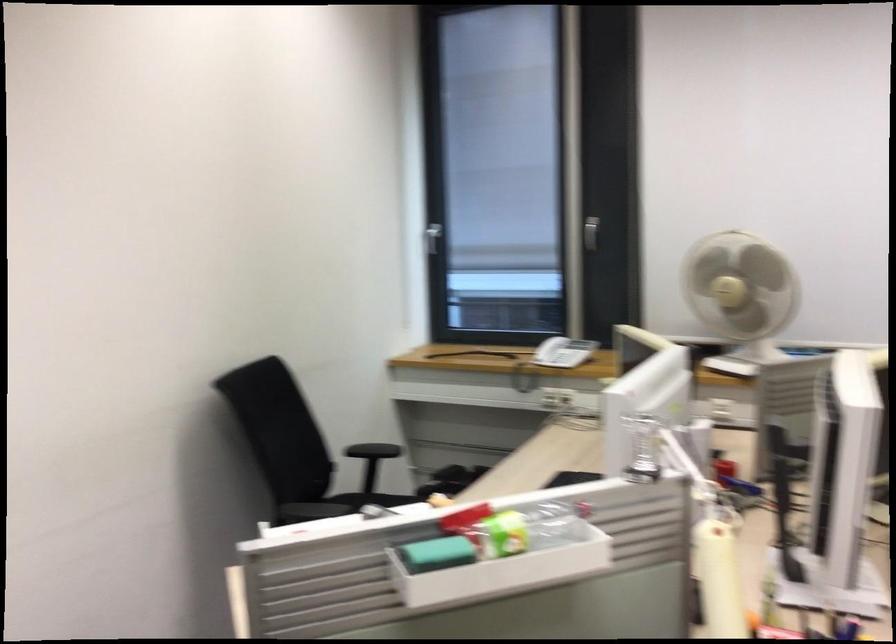
Where would you turn the silver window handle? Please return your answer as a coordinate pair (x, y).

(433, 238)